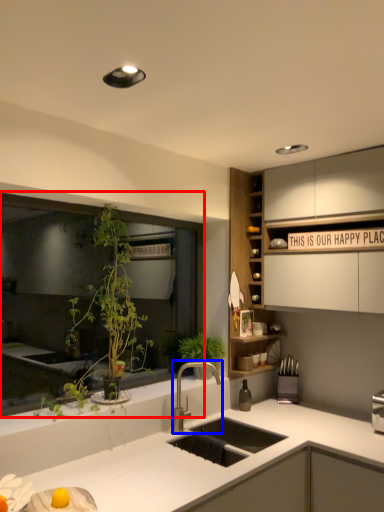
Question: Which of the following is the closest to the observer, window (highlighted by a red box) or tap (highlighted by a blue box)?

Choices:
 (A) window
 (B) tap

Answer: (A)